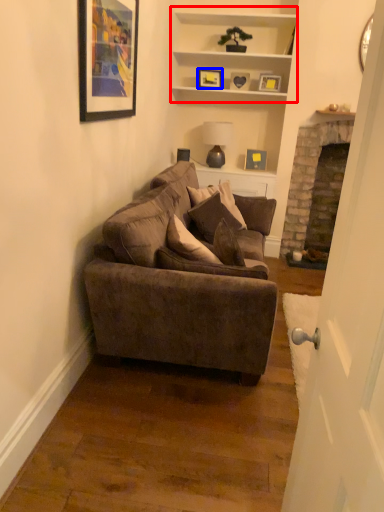
Question: Which point is further to the camera, cabinet (highlighted by a red box) or picture frame (highlighted by a blue box)?

Choices:
 (A) cabinet
 (B) picture frame

Answer: (B)